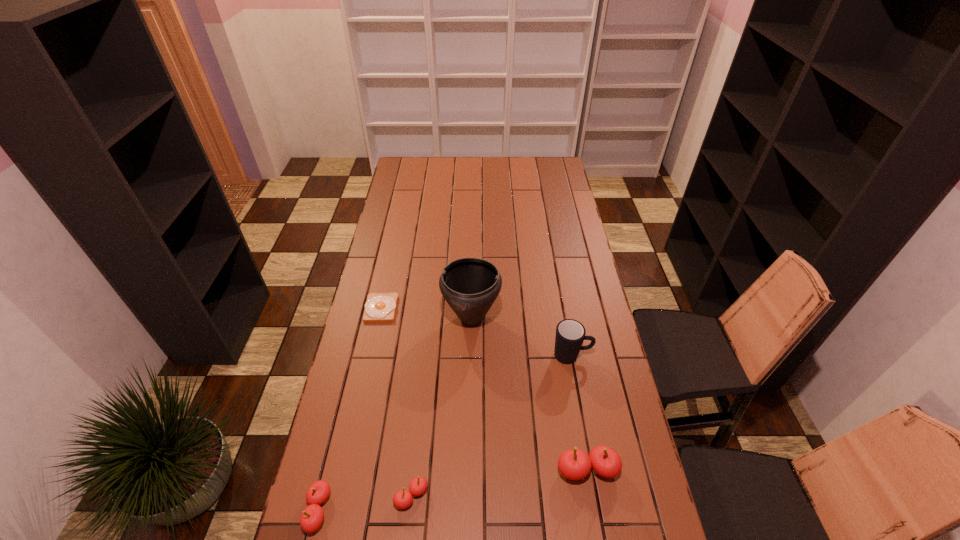
Where is `empty space that is in between the fourth object from left to right and the second cherry from left to right`? The width and height of the screenshot is (960, 540). empty space that is in between the fourth object from left to right and the second cherry from left to right is located at coordinates (442, 407).

Where is `free spot between the tallest object and the tallest cherry`? Image resolution: width=960 pixels, height=540 pixels. free spot between the tallest object and the tallest cherry is located at coordinates (529, 394).

Where is `the closest object to the shortest object`? The height and width of the screenshot is (540, 960). the closest object to the shortest object is located at coordinates (470, 286).

Identify which object is located as the third nearest to the rightmost cherry. Please provide its 2D coordinates. Your answer should be formatted as a tuple, i.e. [(x, y)], where the tuple contains the x and y coordinates of a point satisfying the conditions above.

[(470, 286)]

Locate an element on the screen. cherry that is the closest to the third farthest object is located at coordinates (574, 464).

Locate which cherry is the second closest to the leftmost cherry. Please provide its 2D coordinates. Your answer should be formatted as a tuple, i.e. [(x, y)], where the tuple contains the x and y coordinates of a point satisfying the conditions above.

[(574, 464)]

You are a GUI agent. You are given a task and a screenshot of the screen. Output one action in this format:
    pyautogui.click(x=<x>, y=<y>)
    Task: Click on the free space that satisfies the following two spatial constraints: 1. on the side of the mug with the handle; 2. on the front side of the fifth tallest object
    Image resolution: width=960 pixels, height=540 pixels.
    Given the screenshot: What is the action you would take?
    pyautogui.click(x=597, y=496)

Where is `vacant position in the image that satisfies the following two spatial constraints: 1. on the front side of the third object from right to left; 2. on the left side of the shortest object`? vacant position in the image that satisfies the following two spatial constraints: 1. on the front side of the third object from right to left; 2. on the left side of the shortest object is located at coordinates (379, 318).